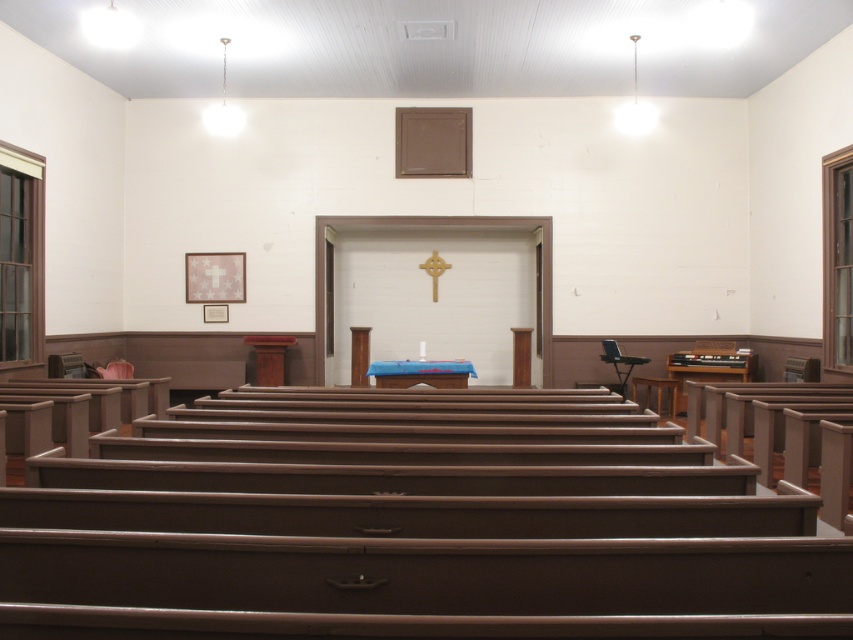
Question: Based on their relative distances, which object is nearer to the brown wooden chair at center?

Choices:
 (A) blue fabric altar at center
 (B) gold metallic cross at center

Answer: (A)

Question: Is brown wooden chair at center smaller than gold metallic cross at center?

Choices:
 (A) yes
 (B) no

Answer: (B)

Question: Is the position of brown wooden chair at center less distant than that of gold metallic cross at center?

Choices:
 (A) no
 (B) yes

Answer: (B)

Question: Which point appears closest to the camera in this image?

Choices:
 (A) (668, 400)
 (B) (399, 362)
 (C) (438, 273)

Answer: (B)

Question: Which is nearer to the brown wooden chair at center?

Choices:
 (A) gold metallic cross at center
 (B) blue fabric altar at center

Answer: (B)

Question: Is blue fabric altar at center to the right of gold metallic cross at center from the viewer's perspective?

Choices:
 (A) no
 (B) yes

Answer: (A)